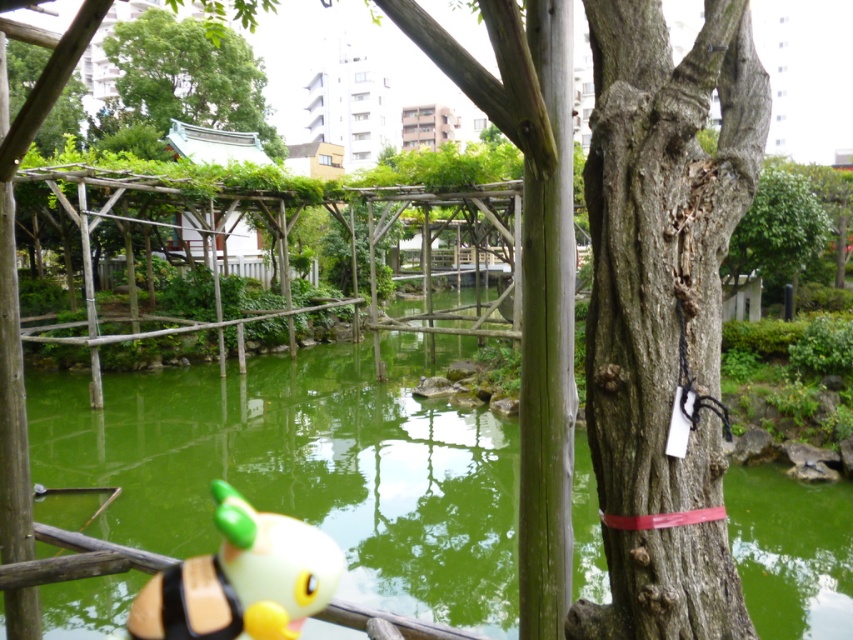
You are standing at the edge of the pond in the urban park scene. There is a point marked at coordinates [305,468]. What is located at that point?

The point at coordinates [305,468] corresponds to green liquid water at center.